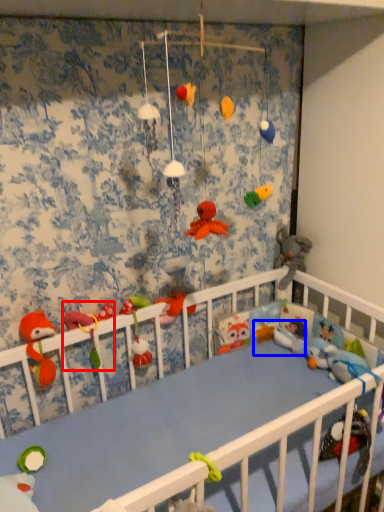
Question: Which point is further to the camera, toy (highlighted by a red box) or toy (highlighted by a blue box)?

Choices:
 (A) toy
 (B) toy

Answer: (B)